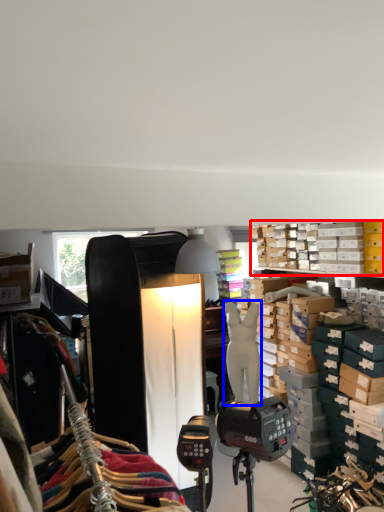
Question: Which point is closer to the camera, shelf (highlighted by a red box) or mannequin (highlighted by a blue box)?

Choices:
 (A) shelf
 (B) mannequin

Answer: (A)